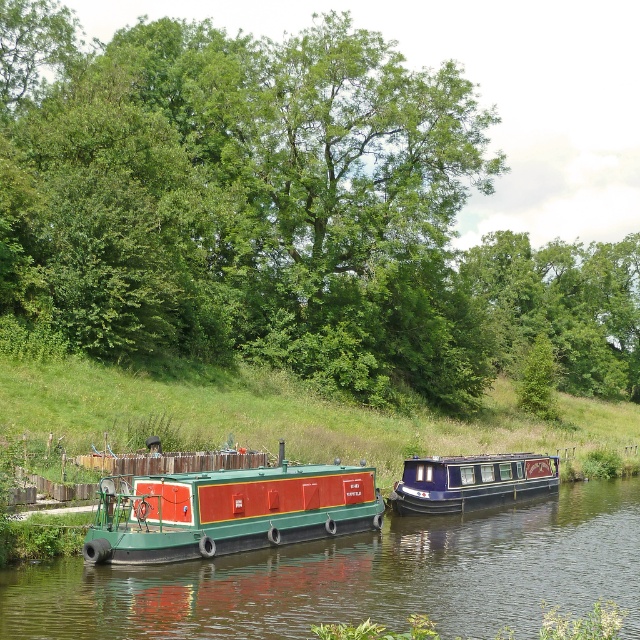
Does green rubber boat at lower left have a lesser width compared to green matte barge at center?

No, green rubber boat at lower left is not thinner than green matte barge at center.

Consider the image. Which is above, green rubber boat at lower left or green matte barge at center?

green matte barge at center is higher up.

Locate an element on the screen. This screenshot has width=640, height=640. green rubber boat at lower left is located at coordinates (358, 577).

The height and width of the screenshot is (640, 640). What are the coordinates of `green rubber boat at lower left` in the screenshot? It's located at (358, 577).

Can you confirm if green leafy tree at center is positioned to the right of green rubber boat at lower left?

Indeed, green leafy tree at center is positioned on the right side of green rubber boat at lower left.

Image resolution: width=640 pixels, height=640 pixels. What do you see at coordinates (278, 216) in the screenshot? I see `green leafy tree at center` at bounding box center [278, 216].

Between point (180, 195) and point (38, 573), which one is positioned in front?

Point (38, 573) is more forward.

You are a GUI agent. You are given a task and a screenshot of the screen. Output one action in this format:
    pyautogui.click(x=<x>, y=<y>)
    Task: Click on the green leafy tree at center
    The image size is (640, 640).
    Given the screenshot: What is the action you would take?
    pyautogui.click(x=278, y=216)

Who is more distant from viewer, (172, 490) or (388, 499)?

The point (388, 499) is behind.

Between green matte barge at center and blue glossy houseboat at center, which one appears on the left side from the viewer's perspective?

green matte barge at center

You are a GUI agent. You are given a task and a screenshot of the screen. Output one action in this format:
    pyautogui.click(x=<x>, y=<y>)
    Task: Click on the green matte barge at center
    The image size is (640, 640).
    Given the screenshot: What is the action you would take?
    pyautogui.click(x=228, y=509)

This screenshot has height=640, width=640. What are the coordinates of `green matte barge at center` in the screenshot? It's located at (228, 509).